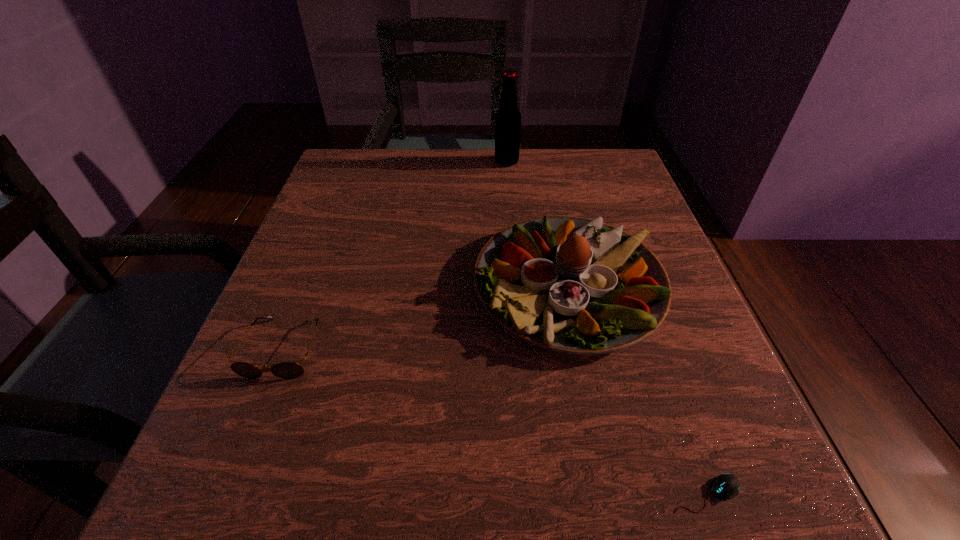
Select which object appears as the second closest to the tallest object. Please provide its 2D coordinates. Your answer should be formatted as a tuple, i.e. [(x, y)], where the tuple contains the x and y coordinates of a point satisfying the conditions above.

[(287, 370)]

Image resolution: width=960 pixels, height=540 pixels. I want to click on vacant region that satisfies the following two spatial constraints: 1. on the lenses of the leftmost object; 2. on the right side of the nearest object, so click(227, 493).

You are a GUI agent. You are given a task and a screenshot of the screen. Output one action in this format:
    pyautogui.click(x=<x>, y=<y>)
    Task: Click on the vacant space that satisfies the following two spatial constraints: 1. on the lenses of the shortest object; 2. on the right side of the leftmost object
    The height and width of the screenshot is (540, 960).
    Given the screenshot: What is the action you would take?
    pyautogui.click(x=227, y=493)

Locate an element on the screen. The height and width of the screenshot is (540, 960). free location that satisfies the following two spatial constraints: 1. on the lenses of the second shortest object; 2. on the right side of the shortest object is located at coordinates (227, 493).

At what (x,y) coordinates should I click in order to perform the action: click on vacant space that satisfies the following two spatial constraints: 1. on the front side of the nearest object; 2. on the left side of the beer bottle. Please return your answer as a coordinate pair (x, y). The height and width of the screenshot is (540, 960). Looking at the image, I should click on (535, 493).

Find the location of a particular element. free location that satisfies the following two spatial constraints: 1. on the lenses of the second shortest object; 2. on the left side of the mouse is located at coordinates (227, 493).

Locate an element on the screen. The width and height of the screenshot is (960, 540). vacant area in the image that satisfies the following two spatial constraints: 1. on the front side of the shortest object; 2. on the left side of the farthest object is located at coordinates tap(535, 493).